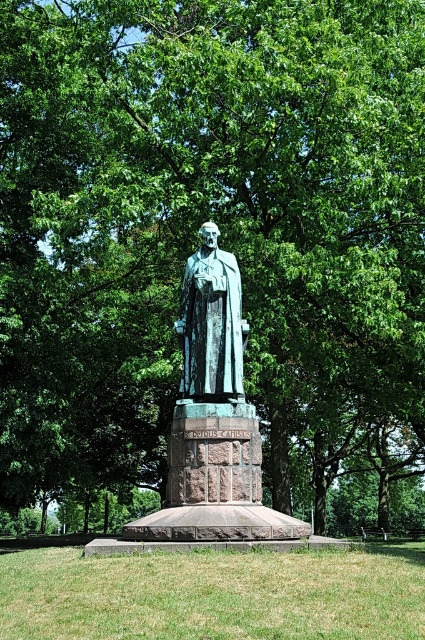
Can you confirm if green grass at center is taller than bronze statue at center?

Incorrect, green grass at center's height is not larger of bronze statue at center's.

Does green grass at center appear on the right side of bronze statue at center?

No, green grass at center is not to the right of bronze statue at center.

Does point (263, 604) lie behind point (178, 320)?

That is False.

Identify the location of green grass at center. Image resolution: width=425 pixels, height=640 pixels. (212, 595).

Is green patina statue at center wider than bronze statue at center?

Correct, the width of green patina statue at center exceeds that of bronze statue at center.

Can you confirm if green patina statue at center is positioned below bronze statue at center?

Correct, green patina statue at center is located below bronze statue at center.

Locate an element on the screen. This screenshot has width=425, height=640. green patina statue at center is located at coordinates (214, 419).

Does green grass at center lie in front of green patina statue at center?

Yes, green grass at center is in front of green patina statue at center.

Who is more forward, (336,604) or (217,324)?

Point (336,604)

Who is more forward, (308,556) or (206,518)?

Point (308,556)

Find the location of a particular element. The image size is (425, 640). green grass at center is located at coordinates (212, 595).